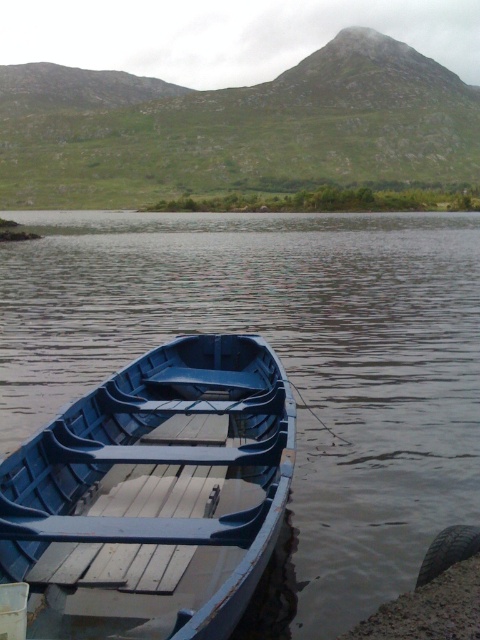
You are planning to take a short trip across the lake. You have to choose between the blue wood boat at center and the matte blue boat at lower left. Which boat should you choose if you want a wider vessel for more stability?

The blue wood boat at center is wider than the matte blue boat at lower left, so you should choose the blue wood boat at center for more stability.

You are a photographer planning to capture both the blue wood boat at center and the matte blue boat at lower left in a single shot. Given their sizes, which boat should you focus on to ensure both are clearly visible in the frame?

The blue wood boat at center is larger in size than the matte blue boat at lower left, so focusing on the larger blue wood boat at center will ensure both are clearly visible while maintaining their proportions in the frame.

You are standing on the lakeside and see the blue wood boat at center and the matte blue boat at lower left. Which boat is closer to the left side of the lake?

The blue wood boat at center is to the left of matte blue boat at lower left, so the blue wood boat at center is closer to the left side of the lake.